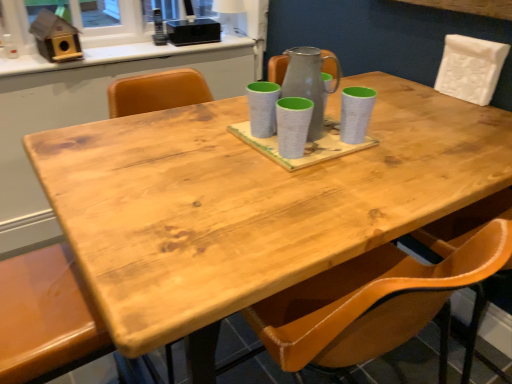
I want to click on free point to the left of matte gray pitcher at center, so click(x=224, y=139).